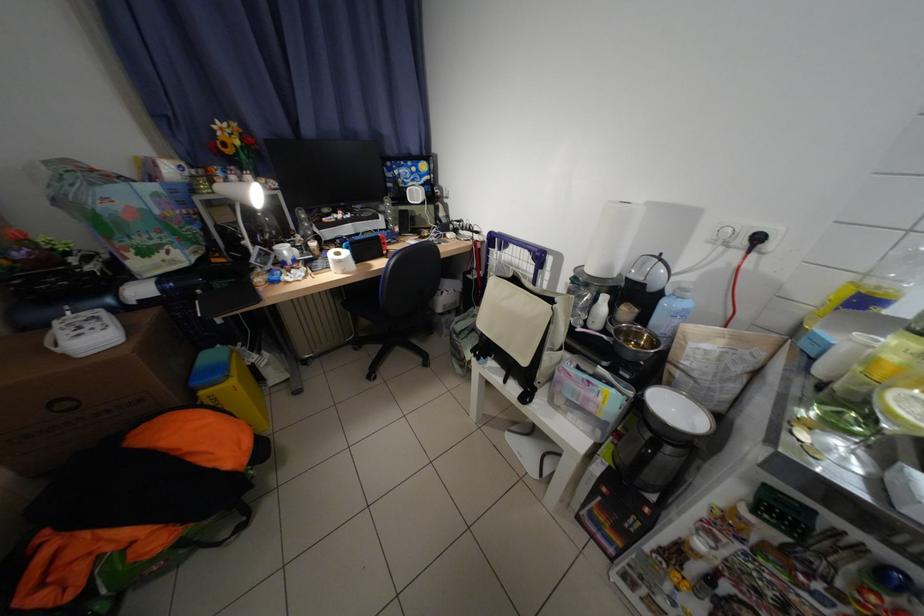
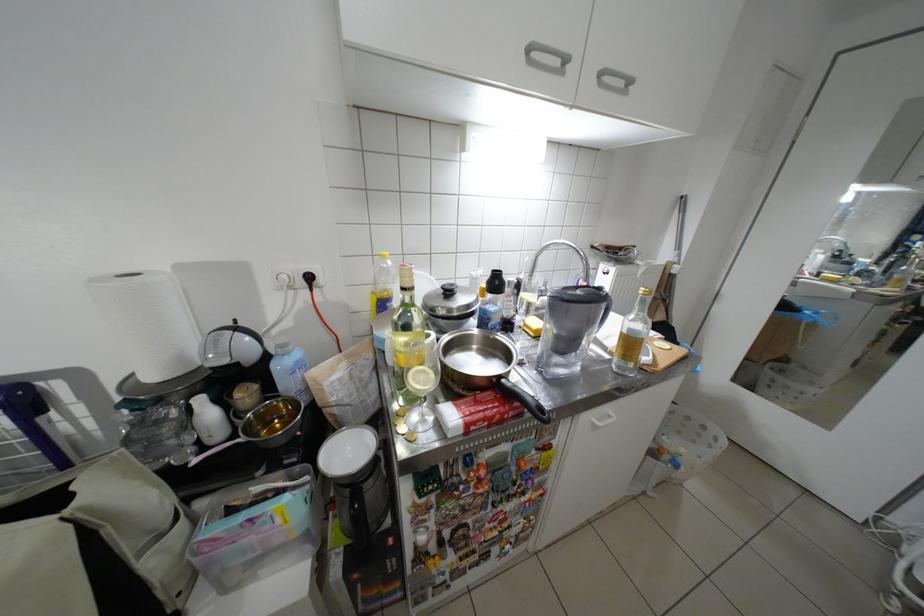
Where in the second image is the point corresponding to pixel 676 305 from the first image?

(287, 367)